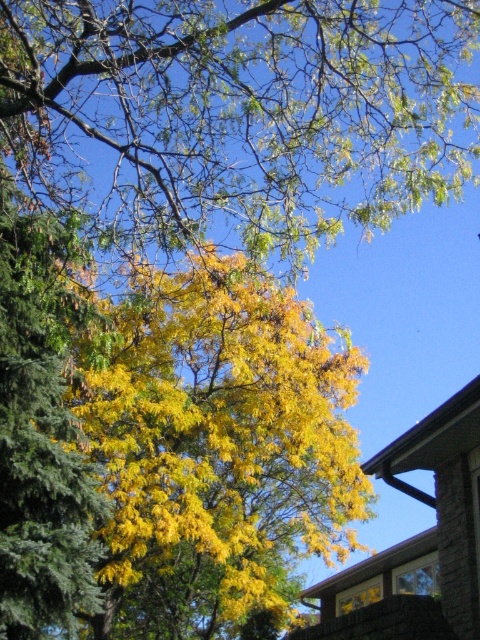
Who is more distant from viewer, (230, 632) or (32, 225)?

The point (230, 632) is more distant.

Which is in front, point (83, 397) or point (83, 508)?

Positioned in front is point (83, 508).

Find the location of a particular element. This screenshot has width=480, height=640. yellow leafy tree at center is located at coordinates (215, 449).

The width and height of the screenshot is (480, 640). What do you see at coordinates (241, 113) in the screenshot? I see `green leafy tree at upper center` at bounding box center [241, 113].

Can you confirm if green leafy tree at upper center is smaller than yellow-green leaves at upper left?

Actually, green leafy tree at upper center might be larger than yellow-green leaves at upper left.

Identify the location of green leafy tree at upper center. This screenshot has width=480, height=640. (241, 113).

This screenshot has width=480, height=640. Find the location of `green leafy tree at upper center`. green leafy tree at upper center is located at coordinates (241, 113).

Between green leafy tree at upper center and yellow leafy tree at center, which one has more height?

Standing taller between the two is yellow leafy tree at center.

Where is `green leafy tree at upper center`? green leafy tree at upper center is located at coordinates (241, 113).

Where is `green leafy tree at upper center`? green leafy tree at upper center is located at coordinates (241, 113).